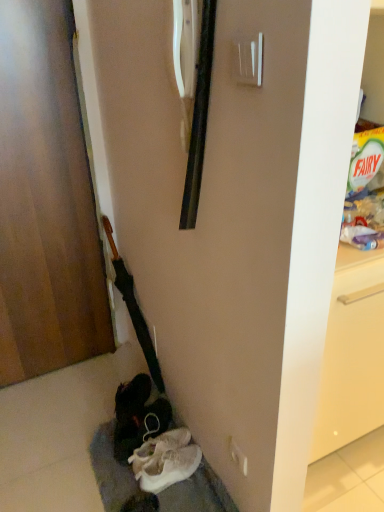
Question: Considering the relative sizes of wooden door at left and white plastic door handle at upper center in the image provided, is wooden door at left wider than white plastic door handle at upper center?

Choices:
 (A) no
 (B) yes

Answer: (B)

Question: Is wooden door at left shorter than white plastic door handle at upper center?

Choices:
 (A) yes
 (B) no

Answer: (B)

Question: Does wooden door at left have a greater height compared to white plastic door handle at upper center?

Choices:
 (A) no
 (B) yes

Answer: (B)

Question: Is wooden door at left to the left of white plastic door handle at upper center from the viewer's perspective?

Choices:
 (A) yes
 (B) no

Answer: (A)

Question: From a real-world perspective, is wooden door at left located higher than white plastic door handle at upper center?

Choices:
 (A) no
 (B) yes

Answer: (A)

Question: Does point (46, 128) appear closer or farther from the camera than point (119, 429)?

Choices:
 (A) closer
 (B) farther

Answer: (A)

Question: Is wooden door at left taller or shorter than white fabric shoe at lower center, which is counted as the second footwear, starting from the front?

Choices:
 (A) tall
 (B) short

Answer: (A)

Question: From the image's perspective, relative to white fabric shoe at lower center, positioned as the first footwear in back-to-front order, is wooden door at left above or below?

Choices:
 (A) below
 (B) above

Answer: (B)

Question: In terms of width, does wooden door at left look wider or thinner when compared to white fabric shoe at lower center, positioned as the first footwear in back-to-front order?

Choices:
 (A) thin
 (B) wide

Answer: (A)

Question: From a real-world perspective, is wooden door at left above or below white suede sneakers at lower center, which is counted as the second footwear, starting from the back?

Choices:
 (A) above
 (B) below

Answer: (A)

Question: Considering the positions of wooden door at left and white suede sneakers at lower center, which is counted as the second footwear, starting from the back, in the image, is wooden door at left taller or shorter than white suede sneakers at lower center, which is counted as the second footwear, starting from the back,?

Choices:
 (A) short
 (B) tall

Answer: (B)

Question: Based on their sizes in the image, would you say wooden door at left is bigger or smaller than white suede sneakers at lower center, which is counted as the second footwear, starting from the back?

Choices:
 (A) small
 (B) big

Answer: (B)

Question: From the image's perspective, is wooden door at left above or below white suede sneakers at lower center, the first footwear when ordered from front to back?

Choices:
 (A) below
 (B) above

Answer: (B)

Question: Is white fabric shoe at lower center, which is counted as the second footwear, starting from the front, inside the boundaries of white suede sneakers at lower center, which is counted as the second footwear, starting from the back, or outside?

Choices:
 (A) inside
 (B) outside

Answer: (B)

Question: In terms of height, does white fabric shoe at lower center, positioned as the first footwear in back-to-front order, look taller or shorter compared to white suede sneakers at lower center, which is counted as the second footwear, starting from the back?

Choices:
 (A) tall
 (B) short

Answer: (A)